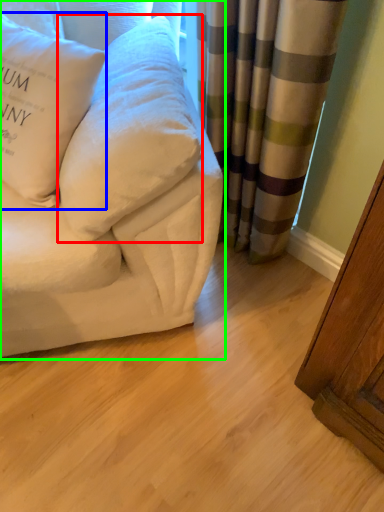
Question: Estimate the real-world distances between objects in this image. Which object is farther from pillow (highlighted by a red box), pillow (highlighted by a blue box) or studio couch (highlighted by a green box)?

Choices:
 (A) pillow
 (B) studio couch

Answer: (A)